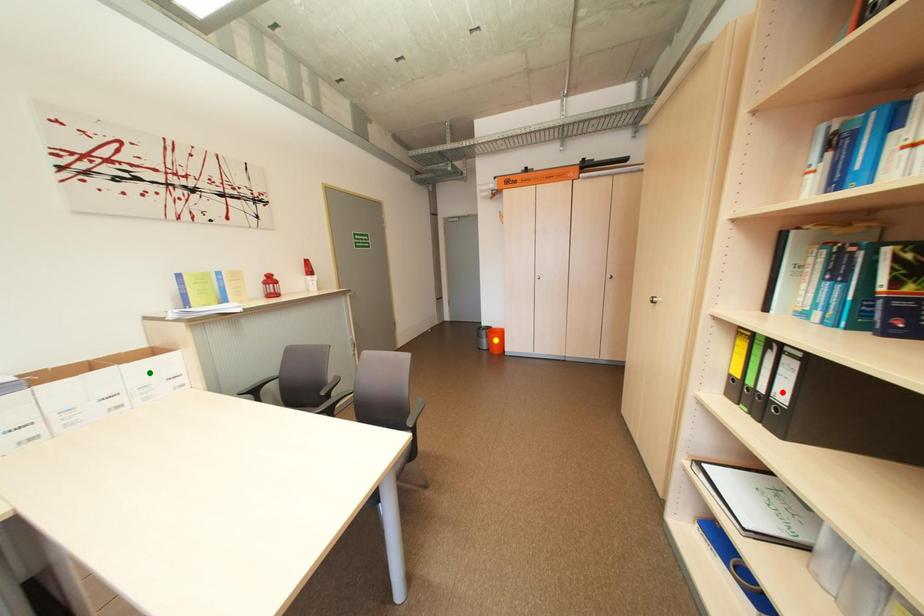
Order these from nearest to farthest:
green point
yellow point
red point

yellow point
green point
red point